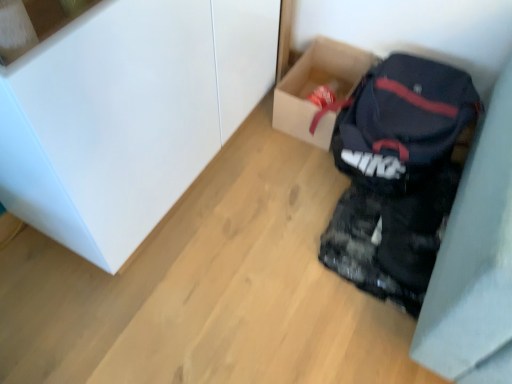
Question: In the image, is white glossy cabinet at upper left on the left side or the right side of matte black backpack at lower right?

Choices:
 (A) right
 (B) left

Answer: (B)

Question: Is white glossy cabinet at upper left in front of or behind matte black backpack at lower right in the image?

Choices:
 (A) behind
 (B) front

Answer: (B)

Question: Estimate the real-world distances between objects in this image. Which object is closer to the cardboard box at center?

Choices:
 (A) matte black backpack at lower right
 (B) white glossy cabinet at upper left

Answer: (A)

Question: Which object is the closest to the cardboard box at center?

Choices:
 (A) white glossy cabinet at upper left
 (B) matte black backpack at lower right

Answer: (B)